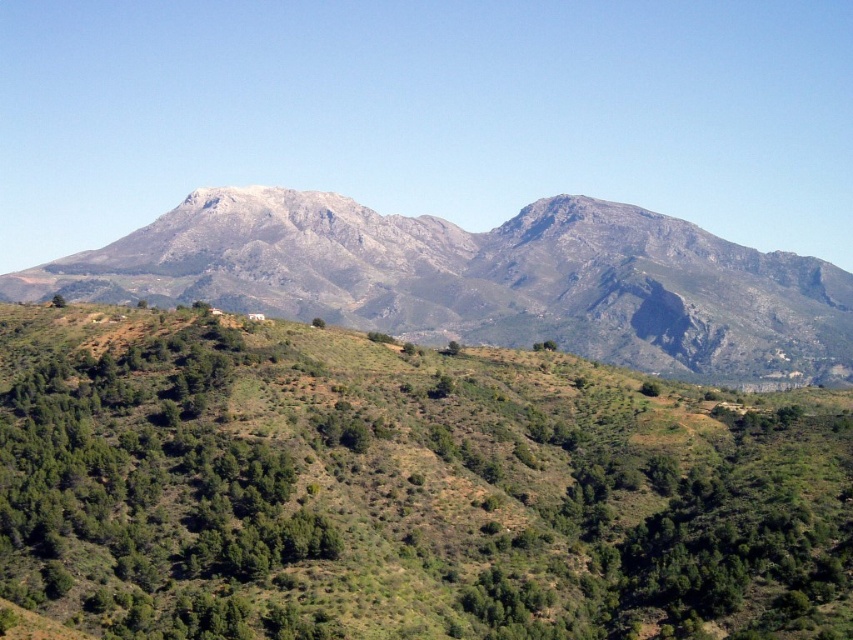
You are standing at the base of the mountain and see the point marked at coordinates (427,429). What does this point indicate?

The point at coordinates (427,429) marks the location of the gray rocky mountain at center.

You are standing at the center of the image and want to walk towards the green leafy tree at lower left. Which direction should you face to head directly towards it?

You should face towards the lower left direction to head directly towards the green leafy tree at lower left, as it is located at point (57, 300).

You are planning a hiking route and need to decide between two landmarks visible from your current position. The gray rocky mountain range at center and the green leafy tree at center. Which one is taller?

The gray rocky mountain range at center is taller than the green leafy tree at center according to the description.